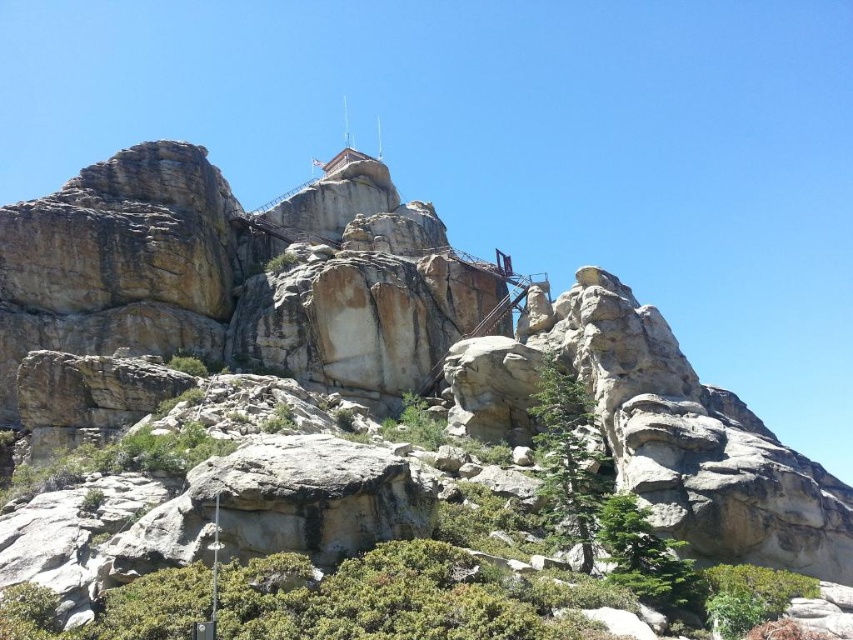
Based on the photo, you are standing at the base of the rock formation and want to place a small picnic blanket between the green textured tree at lower center and the green leafy shrub at lower right. Based on their positions, which direction should you walk from the tree to reach the shrub?

The green textured tree at lower center is positioned on the left side of green leafy shrub at lower right. To reach the shrub from the tree, you should walk to the right.

You are planning to plant a new tree in this rocky landscape. The new tree you want to plant requires a space that is wider than the green textured tree at lower center. Can the green textured tree at center provide enough space for this new tree?

The green textured tree at center has a width less than the green textured tree at lower center, so it cannot provide enough space for the new tree that requires a width larger than the green textured tree at lower center.

You are a hiker planning to take a photo of the fire lookout tower. You want to include both the green textured tree at center and the green leafy shrub at lower right in your frame. Which of these two plants should you position closer to the camera to ensure both are visible in the photo?

To ensure both the green textured tree at center and the green leafy shrub at lower right are visible in your photo, you should position the green leafy shrub at lower right closer to the camera. Since the green textured tree at center is larger, placing the smaller shrub nearer will help balance their sizes in the frame.